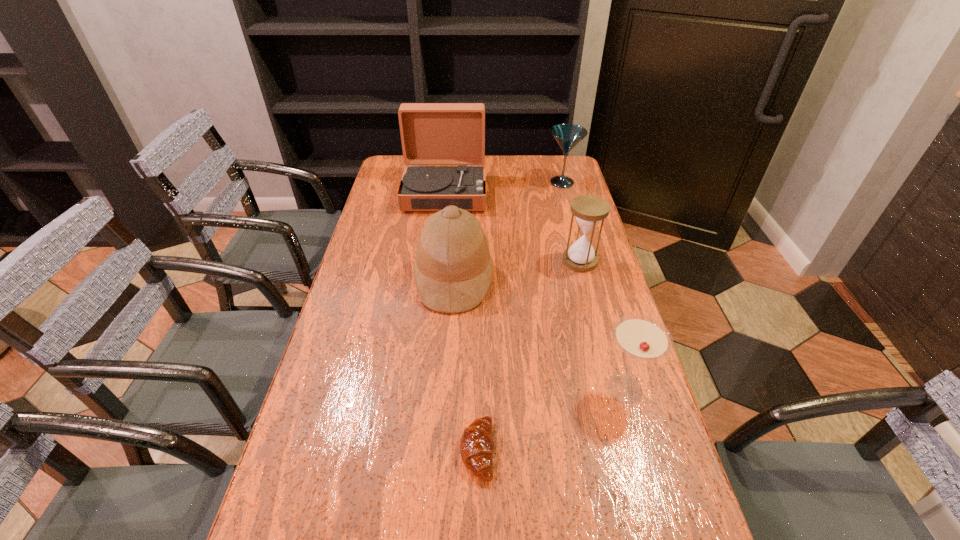
At what (x,y) coordinates should I click in order to perform the action: click on the tallest object. Please return your answer as a coordinate pair (x, y). Image resolution: width=960 pixels, height=540 pixels. Looking at the image, I should click on (431, 133).

Locate an element on the screen. Image resolution: width=960 pixels, height=540 pixels. hat is located at coordinates (453, 268).

Identify the location of the farther martini. This screenshot has width=960, height=540. (567, 136).

At what (x,y) coordinates should I click in order to perform the action: click on hourglass. Please return your answer as a coordinate pair (x, y). The height and width of the screenshot is (540, 960). Looking at the image, I should click on (589, 211).

Locate an element on the screen. The height and width of the screenshot is (540, 960). the nearer martini is located at coordinates (640, 337).

Find the location of `the nearest object`. the nearest object is located at coordinates (477, 446).

At what (x,y) coordinates should I click in order to perform the action: click on the shortest object. Please return your answer as a coordinate pair (x, y). The width and height of the screenshot is (960, 540). Looking at the image, I should click on (477, 446).

Where is `blank space located on the face of the phonograph record`? blank space located on the face of the phonograph record is located at coordinates (441, 231).

Locate an element on the screen. The width and height of the screenshot is (960, 540). vacant space located 0.180m on the front-facing side of the hat is located at coordinates (553, 279).

In order to click on blank space located on the front of the farther martini in this screenshot , I will do `click(568, 206)`.